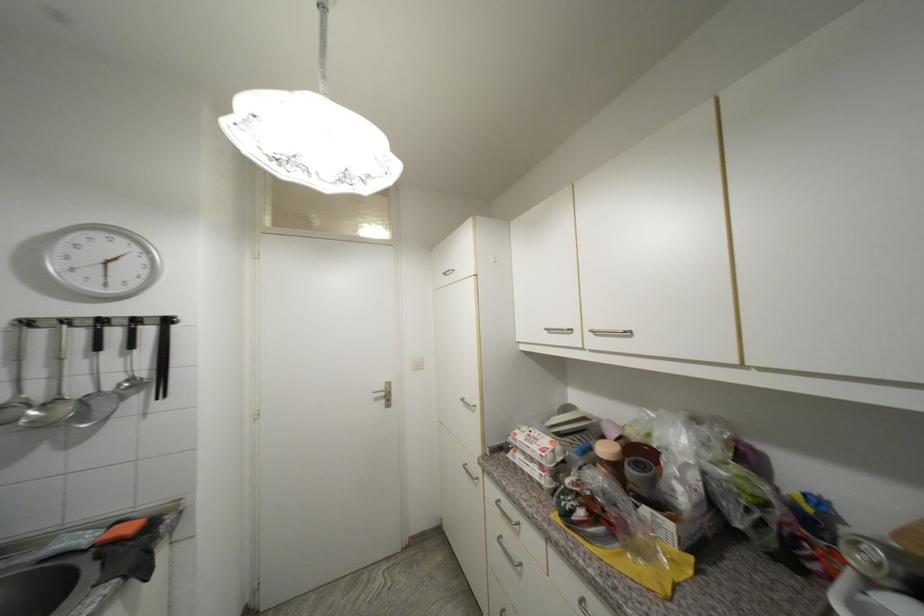
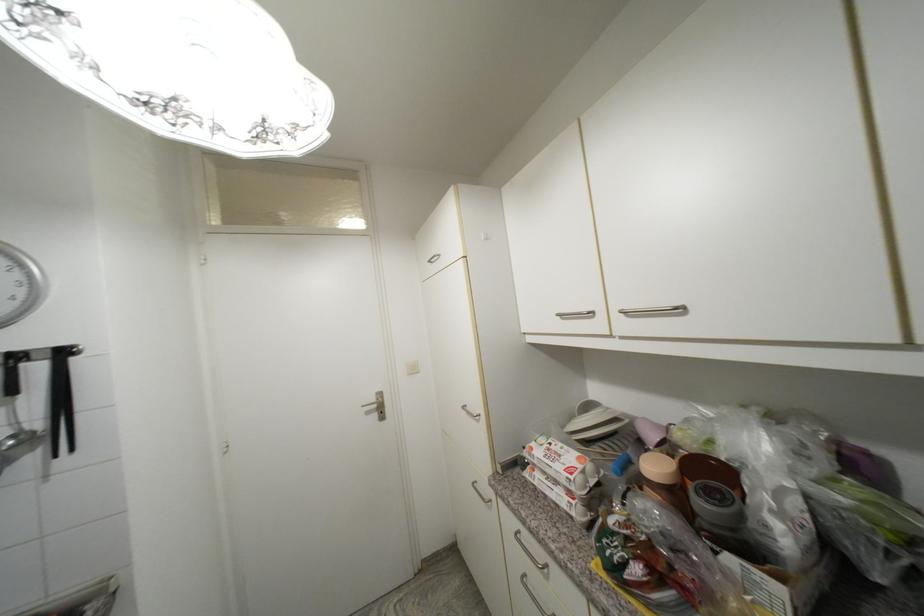
Find the pixel in the second image that matches point 667,413 in the first image.

(730, 410)